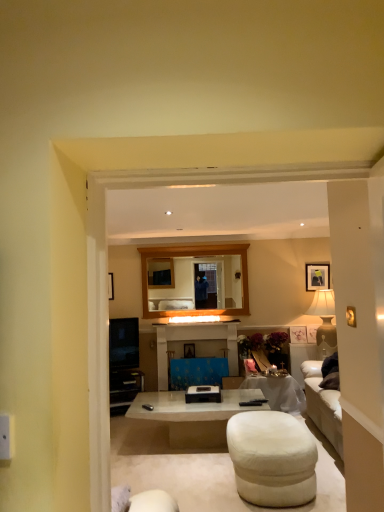
Where is `blue fabric-covered entertainment center at center`? blue fabric-covered entertainment center at center is located at coordinates (195, 343).

What is the approximate height of blue fabric-covered entertainment center at center?

94.00 centimeters.

Where is `wooden-framed mirror at center`? Image resolution: width=384 pixels, height=512 pixels. wooden-framed mirror at center is located at coordinates click(x=196, y=283).

Does white fabric ottoman at lower center have a smaller size compared to white glossy coffee table at center?

Yes.

Would you say white fabric ottoman at lower center is a long distance from white glossy coffee table at center?

No.

Considering the relative positions of white fabric ottoman at lower center and white glossy coffee table at center in the image provided, is white fabric ottoman at lower center to the right of white glossy coffee table at center from the viewer's perspective?

Yes, white fabric ottoman at lower center is to the right of white glossy coffee table at center.

From the image's perspective, who appears lower, blue fabric-covered entertainment center at center or white glossy coffee table at center?

From the image's view, white glossy coffee table at center is below.

Considering the sizes of blue fabric-covered entertainment center at center and white glossy coffee table at center in the image, is blue fabric-covered entertainment center at center bigger or smaller than white glossy coffee table at center?

blue fabric-covered entertainment center at center is bigger than white glossy coffee table at center.

Between blue fabric-covered entertainment center at center and white fabric ottoman at lower center, which one has larger size?

Bigger between the two is blue fabric-covered entertainment center at center.

Which object is thinner, blue fabric-covered entertainment center at center or white fabric ottoman at lower center?

blue fabric-covered entertainment center at center.

From a real-world perspective, is blue fabric-covered entertainment center at center physically below white fabric ottoman at lower center?

No, from a real-world perspective, blue fabric-covered entertainment center at center is not under white fabric ottoman at lower center.

Is blue fabric-covered entertainment center at center in front of or behind white fabric ottoman at lower center in the image?

In the image, blue fabric-covered entertainment center at center appears behind white fabric ottoman at lower center.

Is wooden-framed mirror at center smaller than white fabric ottoman at lower center?

Yes, wooden-framed mirror at center is smaller than white fabric ottoman at lower center.

From a real-world perspective, is wooden-framed mirror at center located higher than white fabric ottoman at lower center?

Yes.

Is wooden-framed mirror at center looking in the opposite direction of white fabric ottoman at lower center?

wooden-framed mirror at center is not turned away from white fabric ottoman at lower center.

Is wooden-framed mirror at center to the left of white fabric ottoman at lower center from the viewer's perspective?

Yes.

From the image's perspective, is white glossy table at center positioned above or below white fabric ottoman at lower center?

white glossy table at center is situated lower than white fabric ottoman at lower center in the image.

Does white glossy table at center have a greater width compared to white fabric ottoman at lower center?

Yes, white glossy table at center is wider than white fabric ottoman at lower center.

Is point (282, 378) in front of point (246, 442)?

That is False.

Is white glossy table at center positioned in front of white fabric ottoman at lower center?

No, it is behind white fabric ottoman at lower center.

Find the location of a particular element. This screenshot has width=384, height=512. table lying behind the white glossy coffee table at center is located at coordinates (278, 392).

From the image's perspective, is white glossy coffee table at center below white glossy table at center?

Incorrect, from the image's perspective, white glossy coffee table at center is higher than white glossy table at center.

Considering the sizes of white glossy coffee table at center and white glossy table at center in the image, is white glossy coffee table at center taller or shorter than white glossy table at center?

white glossy coffee table at center is shorter than white glossy table at center.

Do you think white glossy coffee table at center is within white glossy table at center, or outside of it?

white glossy coffee table at center is not enclosed by white glossy table at center.

Considering the relative positions of white glossy coffee table at center and white fabric ottoman at lower center in the image provided, is white glossy coffee table at center to the right of white fabric ottoman at lower center from the viewer's perspective?

No, white glossy coffee table at center is not to the right of white fabric ottoman at lower center.

From the image's perspective, between white glossy coffee table at center and white fabric ottoman at lower center, who is located below?

white glossy coffee table at center.

Looking at their sizes, would you say white glossy coffee table at center is wider or thinner than white fabric ottoman at lower center?

white glossy coffee table at center is wider than white fabric ottoman at lower center.

Considering the relative positions of white glossy coffee table at center and white fabric ottoman at lower center in the image provided, is white glossy coffee table at center behind white fabric ottoman at lower center?

Yes, white glossy coffee table at center is further from the camera.

Identify the location of coffee table lying below the white fabric ottoman at lower center (from the image's perspective). The height and width of the screenshot is (512, 384). (193, 416).

The image size is (384, 512). I want to click on coffee table on the right of blue fabric-covered entertainment center at center, so click(x=193, y=416).

Based on the photo, based on their spatial positions, is wooden-framed mirror at center or white glossy coffee table at center further from white glossy table at center?

wooden-framed mirror at center is further to white glossy table at center.

Considering their positions, is white fabric ottoman at lower center positioned closer to white glossy coffee table at center than wooden-framed mirror at center?

The object closer to white glossy coffee table at center is white fabric ottoman at lower center.

Which object lies further to the anchor point blue fabric-covered entertainment center at center, white glossy table at center or white fabric ottoman at lower center?

The object further to blue fabric-covered entertainment center at center is white fabric ottoman at lower center.

Which object lies further to the anchor point white glossy coffee table at center, wooden-framed mirror at center or white glossy table at center?

wooden-framed mirror at center is positioned further to the anchor white glossy coffee table at center.

From the image, which object appears to be farther from white fabric ottoman at lower center, white glossy table at center or blue fabric-covered entertainment center at center?

blue fabric-covered entertainment center at center is positioned further to the anchor white fabric ottoman at lower center.

Which object lies further to the anchor point blue fabric-covered entertainment center at center, white glossy coffee table at center or white fabric ottoman at lower center?

Among the two, white fabric ottoman at lower center is located further to blue fabric-covered entertainment center at center.

Which object lies nearer to the anchor point blue fabric-covered entertainment center at center, white glossy coffee table at center or wooden-framed mirror at center?

wooden-framed mirror at center is closer to blue fabric-covered entertainment center at center.

Which object lies nearer to the anchor point white fabric ottoman at lower center, wooden-framed mirror at center or white glossy table at center?

white glossy table at center is closer to white fabric ottoman at lower center.

Where is `entertainment center located between white fabric ottoman at lower center and wooden-framed mirror at center in the depth direction`? entertainment center located between white fabric ottoman at lower center and wooden-framed mirror at center in the depth direction is located at coordinates (195, 343).

Find the location of a particular element. This screenshot has width=384, height=512. entertainment center that lies between wooden-framed mirror at center and white glossy table at center from top to bottom is located at coordinates (195, 343).

The width and height of the screenshot is (384, 512). What are the coordinates of `table between white fabric ottoman at lower center and blue fabric-covered entertainment center at center along the z-axis` in the screenshot? It's located at (278, 392).

Find the location of a particular element. The height and width of the screenshot is (512, 384). coffee table between white fabric ottoman at lower center and blue fabric-covered entertainment center at center along the z-axis is located at coordinates (193, 416).